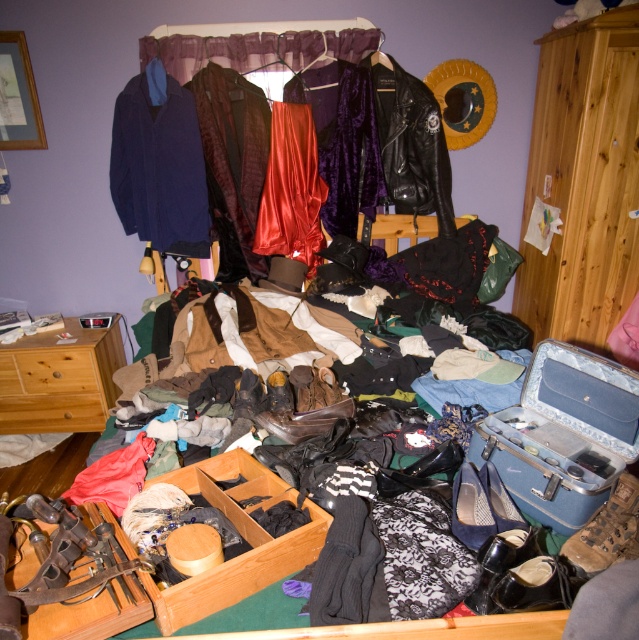
Question: Does navy wool coat at upper left lie in front of leather boot at center?

Choices:
 (A) yes
 (B) no

Answer: (B)

Question: Among these objects, which one is farthest from the camera?

Choices:
 (A) velvet jacket at center
 (B) navy wool coat at upper left
 (C) black leather jacket at center
 (D) brown wood dresser at lower left

Answer: (D)

Question: Is leather high-heeled shoe at center positioned behind leather boot at center?

Choices:
 (A) yes
 (B) no

Answer: (B)

Question: Where is black leather jacket at center located in relation to leather boot at center in the image?

Choices:
 (A) above
 (B) below

Answer: (A)

Question: Which object appears closest to the camera in this image?

Choices:
 (A) shiny red fabric at center
 (B) leather boot at center
 (C) wooden drawer at lower left

Answer: (B)

Question: Which of the following is the farthest from the observer?

Choices:
 (A) (231, 202)
 (B) (49, 406)
 (C) (452, 506)

Answer: (B)